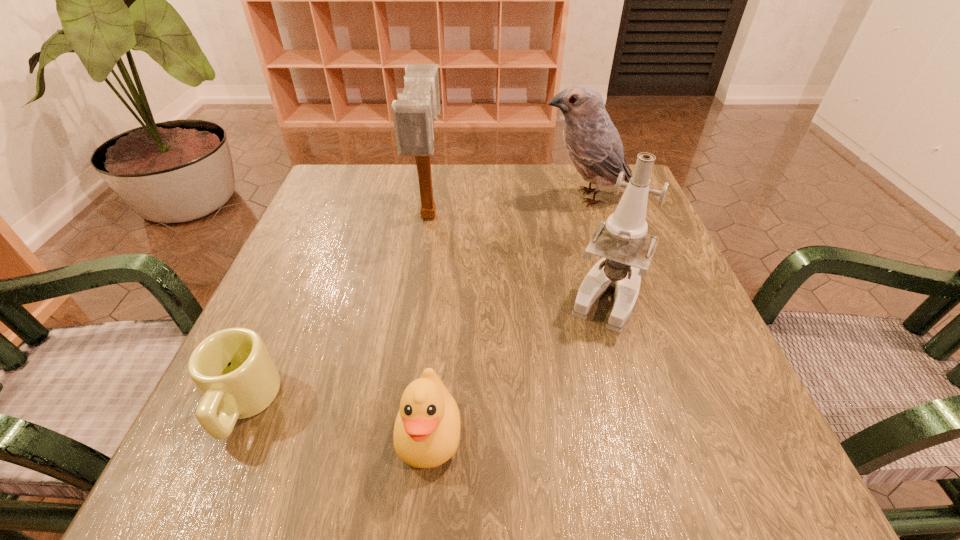
Image resolution: width=960 pixels, height=540 pixels. Identify the location of vacant position located 0.150m on the front-facing side of the parrot. (476, 197).

At what (x,y) coordinates should I click in order to perform the action: click on mallet positioned at the far edge. Please return your answer as a coordinate pair (x, y). The width and height of the screenshot is (960, 540). Looking at the image, I should click on (x=414, y=113).

Identify the location of parrot that is at the far edge. The width and height of the screenshot is (960, 540). (x=592, y=142).

Find the location of a particular element. duck that is at the near edge is located at coordinates point(426,434).

At what (x,y) coordinates should I click in order to perform the action: click on mug that is at the near edge. Please return your answer as a coordinate pair (x, y). Looking at the image, I should click on (232, 368).

Where is `object at the left edge`? object at the left edge is located at coordinates (232, 368).

Find the location of a particular element. This screenshot has height=540, width=960. microscope that is positioned at the right edge is located at coordinates (627, 250).

Find the location of `parrot that is at the right edge`. parrot that is at the right edge is located at coordinates (592, 142).

Find the location of a particular element. The height and width of the screenshot is (540, 960). object present at the near left corner is located at coordinates pos(232,368).

Image resolution: width=960 pixels, height=540 pixels. I want to click on object situated at the far right corner, so click(x=592, y=142).